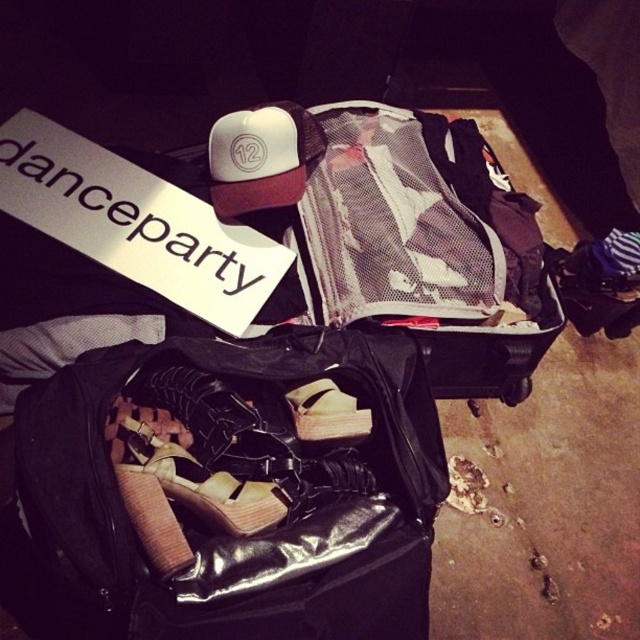
You are organizing items in a storage area and see the white paper sign at upper left and the brown leather shoe at center. Which item is located above the other?

The white paper sign at upper left is positioned over brown leather shoe at center, so it is above it.

You are organizing items in a storage room and see the matte black suitcase at center and the white paper sign at upper left. Which object is positioned higher up in the image?

The matte black suitcase at center is located above the white paper sign at upper left, so it is positioned higher up in the image.

You are organizing items in a storage room and need to place the matte black suitcase at center and the white paper sign at upper left. Given their sizes, which object should be placed in a larger designated space?

The matte black suitcase at center is larger in size than the white paper sign at upper left, so the larger designated space should be allocated for the matte black suitcase at center.